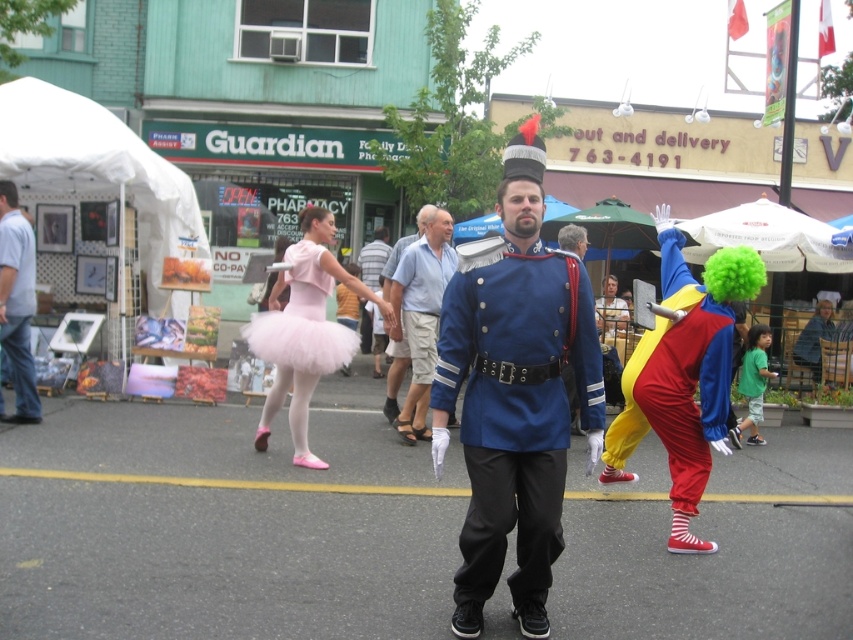
Question: Where is shiny blue uniform at center located in relation to light blue cotton shirt at left in the image?

Choices:
 (A) right
 (B) left

Answer: (A)

Question: Does shiny blue uniform at center have a smaller size compared to matte pink tutu at center?

Choices:
 (A) yes
 (B) no

Answer: (A)

Question: Among these points, which one is nearest to the camera?

Choices:
 (A) click(305, 342)
 (B) click(691, 550)

Answer: (B)

Question: Does shiny blue uniform at center have a lesser width compared to pink tulle dress at center?

Choices:
 (A) no
 (B) yes

Answer: (B)

Question: Which of these objects is positioned closest to the light blue cotton shirt at left?

Choices:
 (A) pink tulle dress at center
 (B) shiny blue uniform at center
 (C) light blue fabric uniform at center

Answer: (A)

Question: Considering the real-world distances, which object is farthest from the shiny blue uniform at center?

Choices:
 (A) light blue cotton shirt at left
 (B) pink tulle dress at center
 (C) blue uniform at center

Answer: (A)